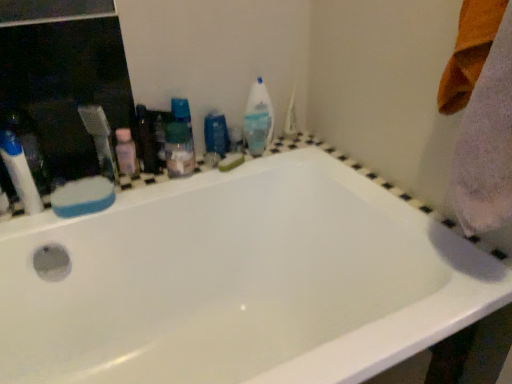
Question: Which direction should I rotate to look at green sponge at upper center, the 1th soap in the back-to-front sequence?

Choices:
 (A) left
 (B) right

Answer: (A)

Question: Is translucent plastic mouthwash at center, the 1th mouthwash from the left, shorter than translucent plastic toothbrush at left, the 1th toiletry positioned from the front?

Choices:
 (A) no
 (B) yes

Answer: (B)

Question: From a real-world perspective, is translucent plastic mouthwash at center, which is counted as the 1th mouthwash, starting from the front, physically above translucent plastic toothbrush at left, marked as the 2th toiletry in a back-to-front arrangement?

Choices:
 (A) yes
 (B) no

Answer: (B)

Question: Can you confirm if translucent plastic mouthwash at center, the second mouthwash in the back-to-front sequence, is positioned to the left of translucent plastic toothbrush at left, marked as the 1th toiletry in a left-to-right arrangement?

Choices:
 (A) yes
 (B) no

Answer: (B)

Question: Is translucent plastic mouthwash at center, placed as the 2th mouthwash when sorted from right to left, at the right side of translucent plastic toothbrush at left, the 1th toiletry positioned from the front?

Choices:
 (A) yes
 (B) no

Answer: (A)

Question: Does translucent plastic mouthwash at center, placed as the 2th mouthwash when sorted from right to left, have a greater height compared to translucent plastic toothbrush at left, the 1th toiletry positioned from the front?

Choices:
 (A) yes
 (B) no

Answer: (B)

Question: From the image's perspective, does translucent plastic mouthwash at center, the 1th mouthwash from the left, appear lower than translucent plastic toothbrush at left, the 1th toiletry positioned from the front?

Choices:
 (A) yes
 (B) no

Answer: (B)

Question: Is pink plastic bottle at upper left, the second toiletry positioned from the front, next to white plastic toothbrush at left?

Choices:
 (A) yes
 (B) no

Answer: (A)

Question: Can you confirm if pink plastic bottle at upper left, the first toiletry when ordered from back to front, is smaller than white plastic toothbrush at left?

Choices:
 (A) no
 (B) yes

Answer: (B)

Question: Is white plastic toothbrush at left at the back of pink plastic bottle at upper left, the first toiletry when ordered from back to front?

Choices:
 (A) no
 (B) yes

Answer: (A)

Question: Is pink plastic bottle at upper left, the second toiletry positioned from the front, at the right side of white plastic toothbrush at left?

Choices:
 (A) no
 (B) yes

Answer: (B)

Question: Is white plastic toothbrush at left a part of pink plastic bottle at upper left, the second toiletry viewed from the left?

Choices:
 (A) no
 (B) yes

Answer: (A)

Question: Are pink plastic bottle at upper left, the second toiletry positioned from the front, and white plastic toothbrush at left far apart?

Choices:
 (A) yes
 (B) no

Answer: (B)

Question: Is white plastic toothbrush at left outside pink plastic bottle at upper left, the second toiletry viewed from the left?

Choices:
 (A) no
 (B) yes

Answer: (B)